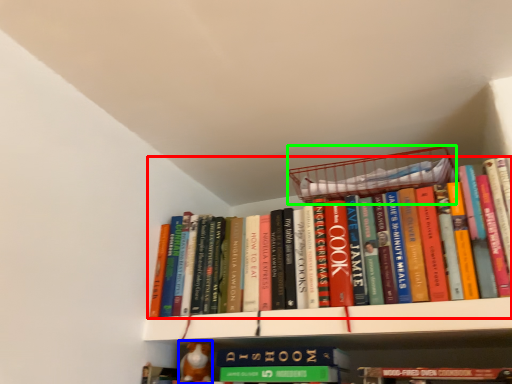
Question: Based on their relative distances, which object is farther from book (highlighted by a red box)? Choose from toy (highlighted by a blue box) and basket (highlighted by a green box).

Choices:
 (A) toy
 (B) basket

Answer: (A)